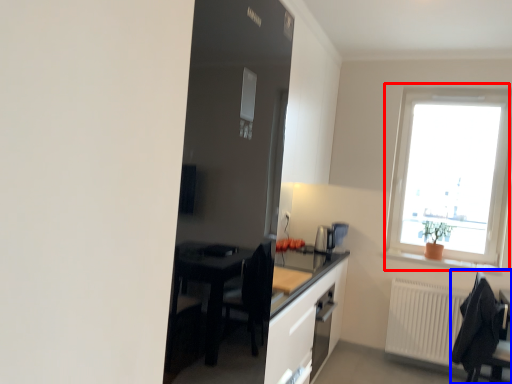
Question: Among these objects, which one is farthest to the camera, window (highlighted by a red box) or chair (highlighted by a blue box)?

Choices:
 (A) window
 (B) chair

Answer: (A)